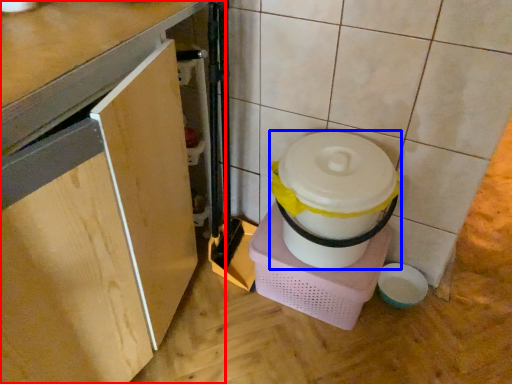
Question: Among these objects, which one is farthest to the camera, cabinetry (highlighted by a red box) or appliance (highlighted by a blue box)?

Choices:
 (A) cabinetry
 (B) appliance

Answer: (B)